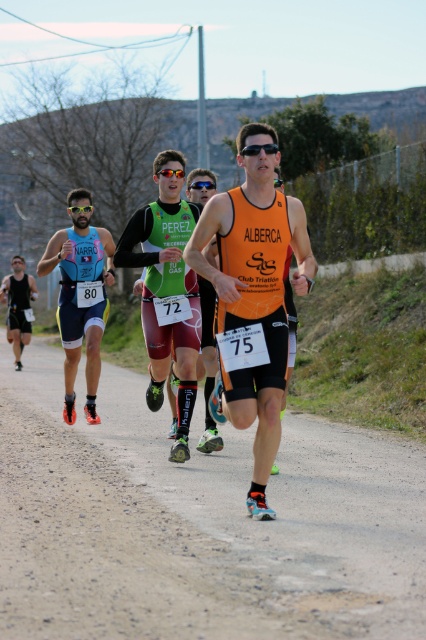
Question: Is orange fabric singlet at center closer to the viewer compared to blue reflective sunglasses at center?

Choices:
 (A) no
 (B) yes

Answer: (B)

Question: Which object is closer to the camera taking this photo?

Choices:
 (A) blue reflective sunglasses at center
 (B) matte blue triathlon suit at left
 (C) black plastic sunglasses at center
 (D) green fabric jersey at center

Answer: (C)

Question: Does green fabric jersey at center appear over blue reflective sunglasses at center?

Choices:
 (A) yes
 (B) no

Answer: (B)

Question: Which of the following is the farthest from the observer?

Choices:
 (A) orange fabric singlet at center
 (B) matte black shorts at left
 (C) blue reflective sunglasses at center

Answer: (B)

Question: Is orange fabric singlet at center wider than blue reflective sunglasses at center?

Choices:
 (A) yes
 (B) no

Answer: (A)

Question: Which point is farther to the camera?

Choices:
 (A) black plastic sunglasses at center
 (B) orange fabric singlet at center

Answer: (A)